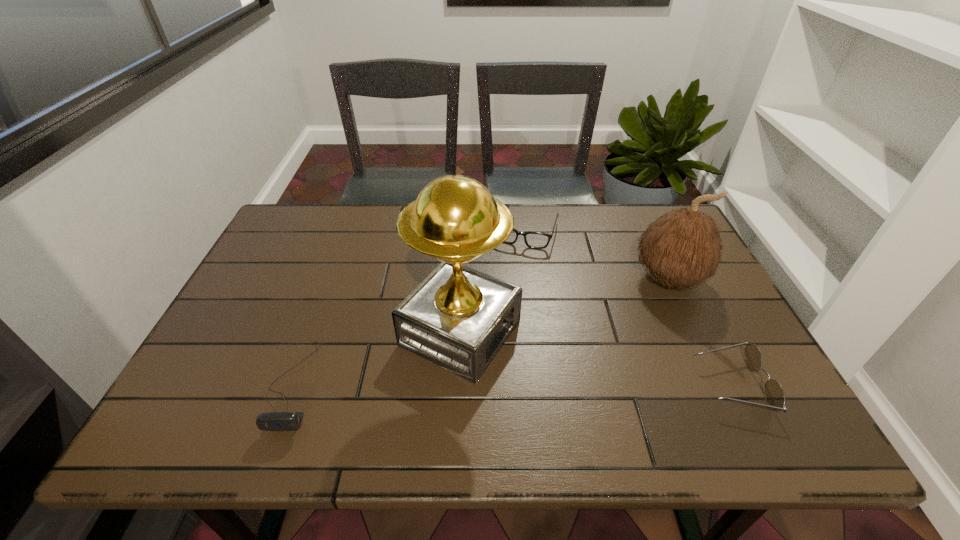
Image resolution: width=960 pixels, height=540 pixels. I want to click on vacant space on the desktop that is between the webcam and the right spectacles and is positioned on the surface of the coconut, so click(x=544, y=385).

Where is `vacant space on the desktop that is between the leftmost object and the right spectacles and is positioned on the front-facing side of the tallest object`? The image size is (960, 540). vacant space on the desktop that is between the leftmost object and the right spectacles and is positioned on the front-facing side of the tallest object is located at coordinates (575, 385).

You are a GUI agent. You are given a task and a screenshot of the screen. Output one action in this format:
    pyautogui.click(x=<x>, y=<y>)
    Task: Click on the free space on the desktop that is between the leftmost object and the right spectacles and is positioned on the front-facing side of the left spectacles
    The image size is (960, 540).
    Given the screenshot: What is the action you would take?
    pyautogui.click(x=463, y=385)